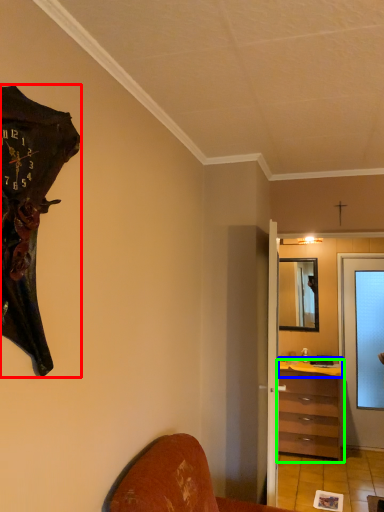
Question: Estimate the real-world distances between objects in this image. Which object is closer to wall clock (highlighted by a red box), counter top (highlighted by a blue box) or chest of drawers (highlighted by a green box)?

Choices:
 (A) counter top
 (B) chest of drawers

Answer: (B)